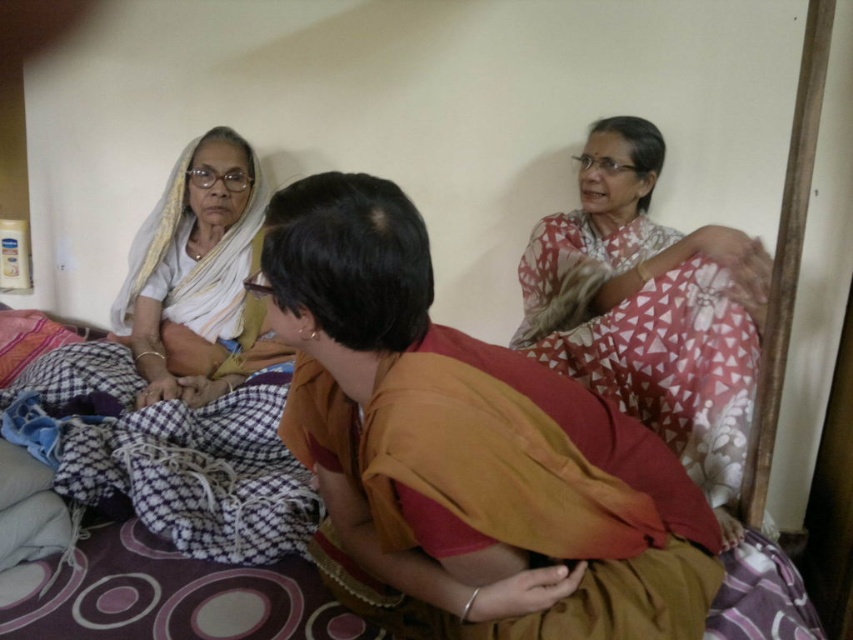
You are an interior designer planning to place a new decorative item on the bed where the orange cotton saree at center is currently located. The bed is a standard queen size. Can you confirm if there is enough space for the new item without overlapping the saree?

The orange cotton saree at center is positioned at coordinates point (467,445). Since the bed is standard queen size, there should be sufficient space around the saree to place the new item without overlapping.